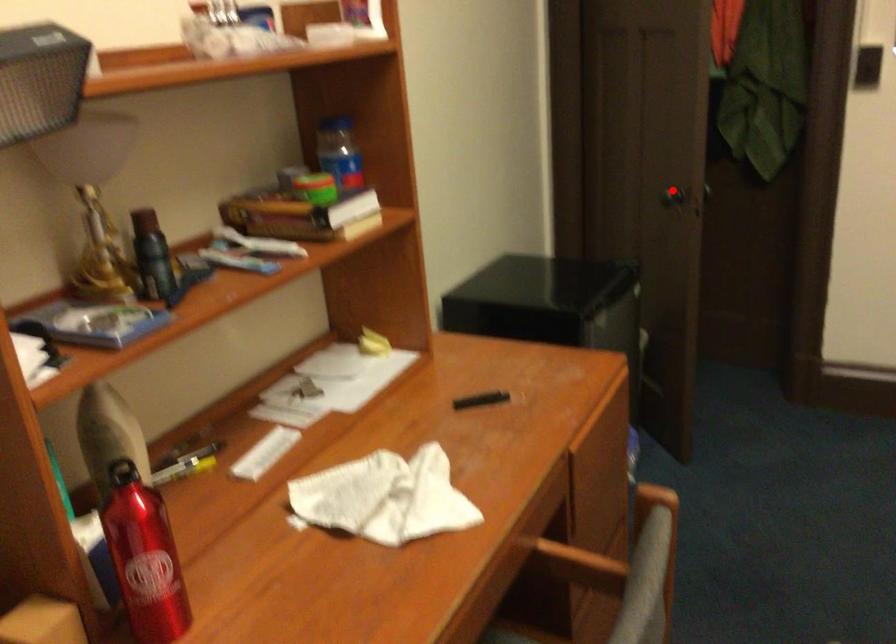
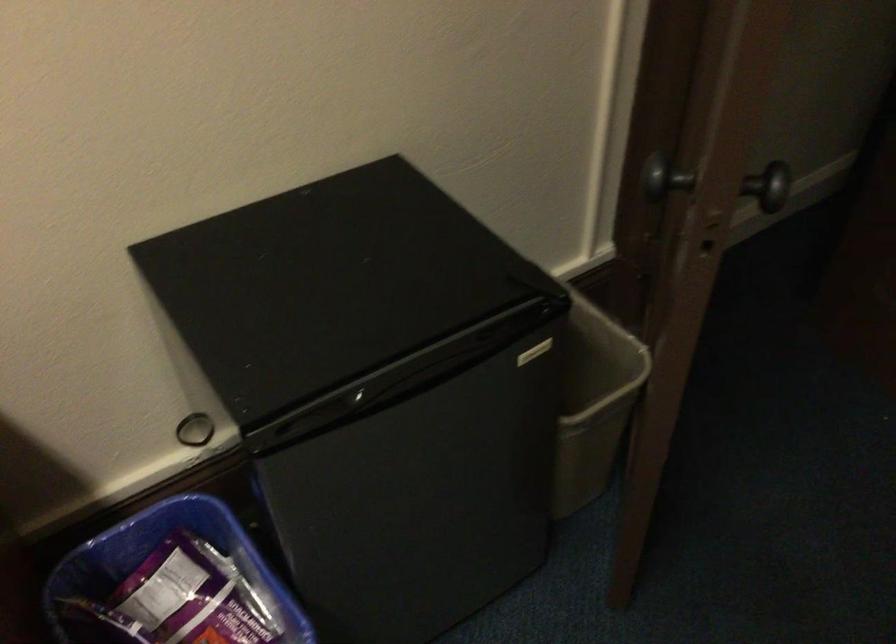
Question: I am providing you with two images of the same scene from different viewpoints. Image1 has a red point marked. In image2, the corresponding 3D location appears at what relative position? Reply with the corresponding letter.

Choices:
 (A) Closer
 (B) Farther

Answer: (A)